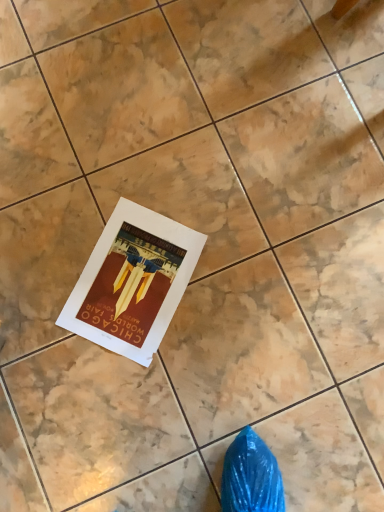
This screenshot has height=512, width=384. Identify the location of vacant region to the right of matte paper poster at center. (240, 293).